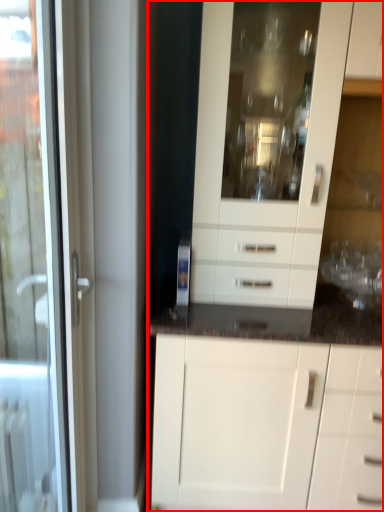
Question: From the image's perspective, what is the correct spatial positioning of cabinetry (annotated by the red box) in reference to door?

Choices:
 (A) below
 (B) above

Answer: (B)